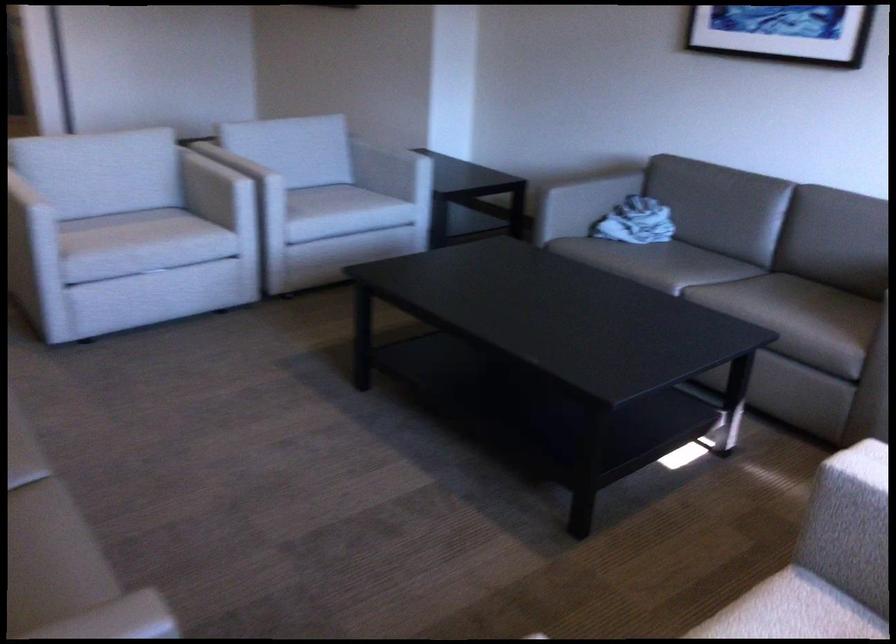
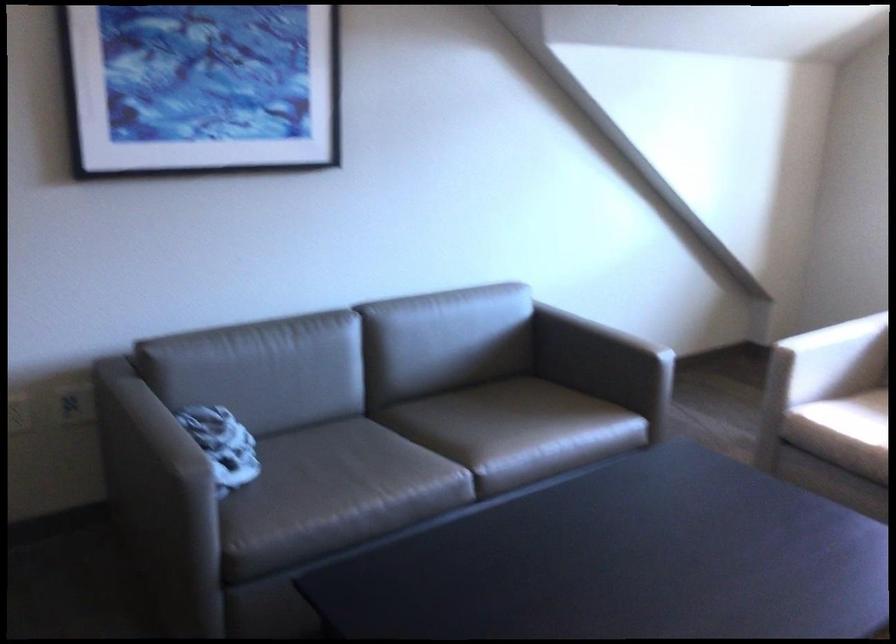
In the second image, find the point that corresponds to (530,190) in the first image.

(158, 491)